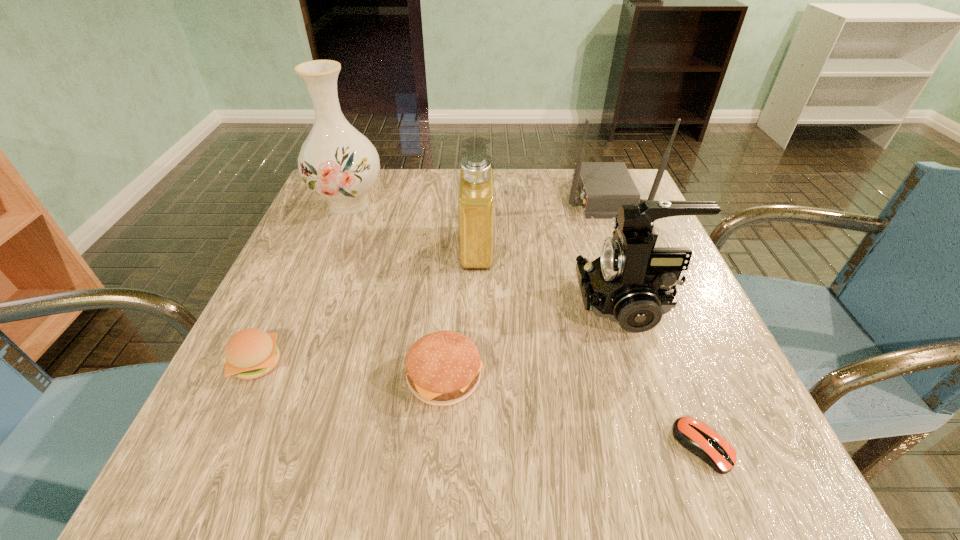
You are a GUI agent. You are given a task and a screenshot of the screen. Output one action in this format:
    pyautogui.click(x=<x>, y=<y>)
    Task: Click on the router that is at the far edge
    This screenshot has width=960, height=540.
    Given the screenshot: What is the action you would take?
    pyautogui.click(x=602, y=187)

At what (x,y) coordinates should I click in order to perform the action: click on object present at the near edge. Please return your answer as a coordinate pair (x, y). The height and width of the screenshot is (540, 960). Looking at the image, I should click on (694, 435).

This screenshot has height=540, width=960. In order to click on vase positioned at the left edge in this screenshot , I will do `click(337, 162)`.

Locate an element on the screen. hamburger located in the left edge section of the desktop is located at coordinates (251, 353).

Locate an element on the screen. router that is at the right edge is located at coordinates (602, 187).

Image resolution: width=960 pixels, height=540 pixels. I want to click on camcorder situated at the right edge, so click(631, 282).

Where is `computer mouse situated at the right edge`? computer mouse situated at the right edge is located at coordinates (694, 435).

Identify the location of object that is positioned at the far left corner. (337, 162).

The image size is (960, 540). I want to click on object located at the far right corner, so click(x=602, y=187).

The image size is (960, 540). What are the coordinates of `object that is at the near right corner` in the screenshot? It's located at (694, 435).